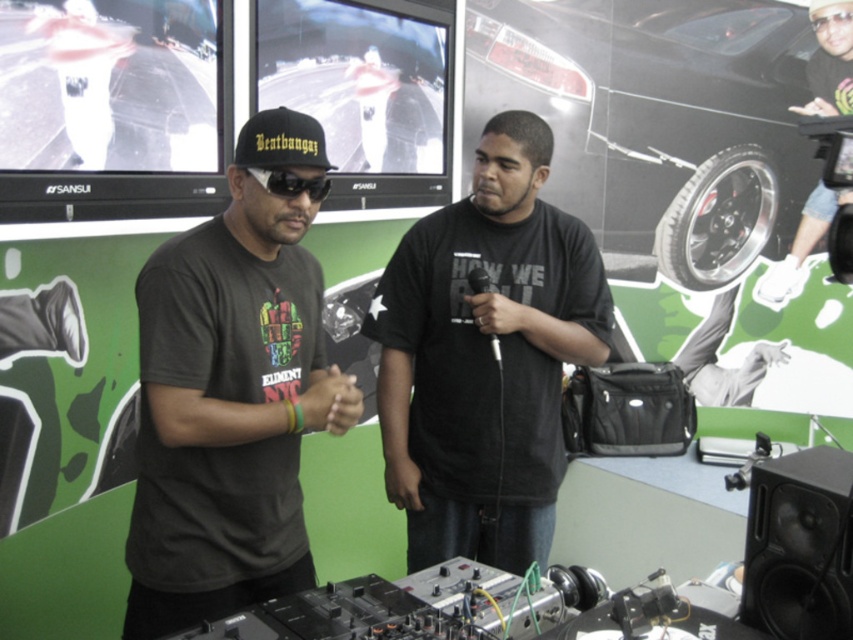
Question: Which object appears closest to the camera in this image?

Choices:
 (A) black matte baseball cap at upper center
 (B) matte black t-shirt at center
 (C) black matte sunglasses at center

Answer: (B)

Question: Can you confirm if black matte shirt at center is positioned to the left of black matte sunglasses at center?

Choices:
 (A) no
 (B) yes

Answer: (A)

Question: Which of the following is the farthest from the observer?

Choices:
 (A) black matte baseball cap at upper center
 (B) transparent plastic goggles at upper right
 (C) black matte shirt at center

Answer: (B)

Question: Is matte black t-shirt at center to the right of black matte camera at upper right from the viewer's perspective?

Choices:
 (A) no
 (B) yes

Answer: (A)

Question: Based on their relative distances, which object is farther from the black matte baseball cap at upper center?

Choices:
 (A) black matte sunglasses at center
 (B) transparent plastic goggles at upper right

Answer: (B)

Question: Is black matte camera at upper right to the right of black matte sunglasses at center from the viewer's perspective?

Choices:
 (A) yes
 (B) no

Answer: (A)